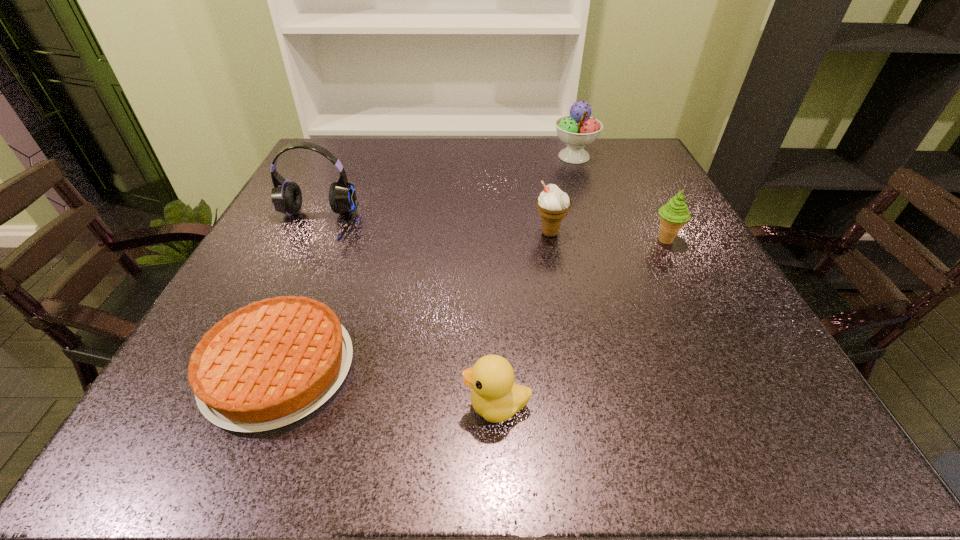
Select which icecream is the second closest to the fourth object from right to left. Please provide its 2D coordinates. Your answer should be formatted as a tuple, i.e. [(x, y)], where the tuple contains the x and y coordinates of a point satisfying the conditions above.

[(674, 213)]

Find the location of a particular element. This screenshot has height=540, width=960. vacant space that satisfies the following two spatial constraints: 1. on the ear cushions of the headset; 2. on the left side of the rightmost icecream is located at coordinates (307, 240).

In order to click on free spot that satisfies the following two spatial constraints: 1. on the ear cushions of the rightmost object; 2. on the left side of the headset in this screenshot , I will do click(x=307, y=240).

Locate an element on the screen. This screenshot has width=960, height=540. blank space that satisfies the following two spatial constraints: 1. on the back side of the shortest object; 2. on the right side of the rightmost object is located at coordinates (331, 240).

Find the location of a particular element. The image size is (960, 540). blank space that satisfies the following two spatial constraints: 1. on the ear cushions of the headset; 2. on the left side of the shortest object is located at coordinates (247, 368).